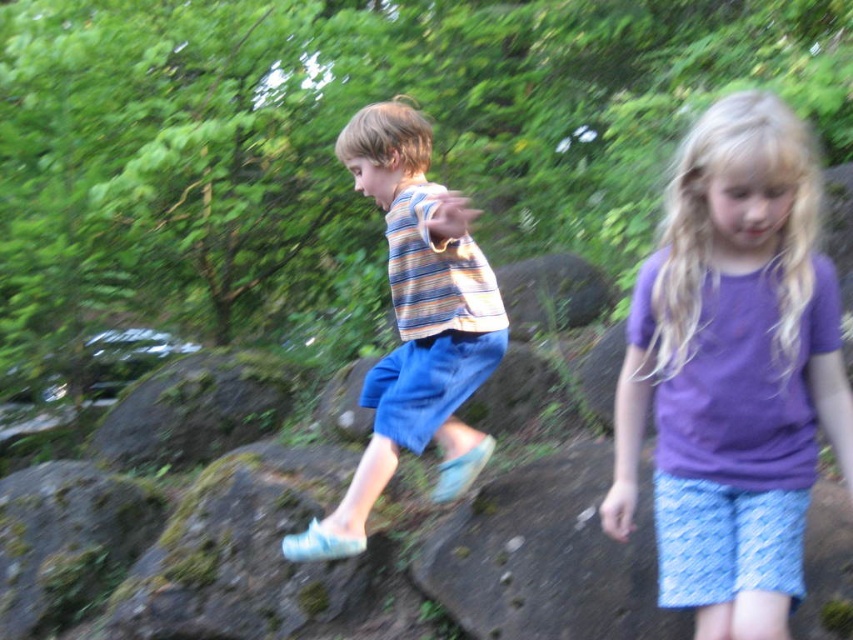
Who is positioned more to the left, purple cotton shirt at center or green mossy rock at center?

Positioned to the left is green mossy rock at center.

Is purple cotton shirt at center in front of green mossy rock at center?

Yes, it is in front of green mossy rock at center.

Locate an element on the screen. The width and height of the screenshot is (853, 640). purple cotton shirt at center is located at coordinates (733, 371).

Can you confirm if purple cotton shirt at center is positioned to the left of striped cotton shirt at center?

No, purple cotton shirt at center is not to the left of striped cotton shirt at center.

Between purple cotton shirt at center and striped cotton shirt at center, which one appears on the right side from the viewer's perspective?

Positioned to the right is purple cotton shirt at center.

Is point (809, 276) positioned behind point (407, 113)?

No, it is in front of (407, 113).

Image resolution: width=853 pixels, height=640 pixels. What are the coordinates of `purple cotton shirt at center` in the screenshot? It's located at (733, 371).

Who is shorter, green mossy rock at lower left or green mossy rock at center?

green mossy rock at lower left is shorter.

I want to click on green mossy rock at lower left, so click(67, 541).

This screenshot has height=640, width=853. What are the coordinates of `green mossy rock at lower left` in the screenshot? It's located at (67, 541).